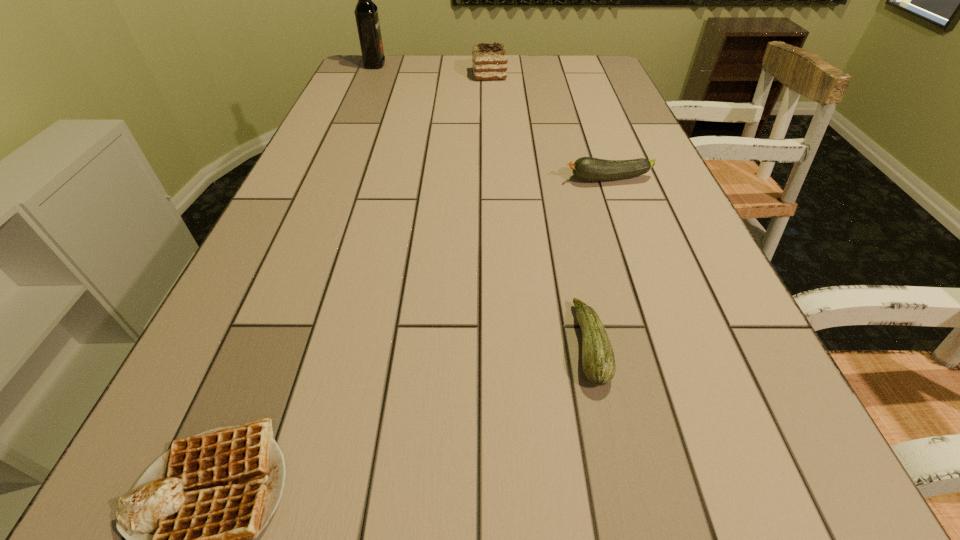
This screenshot has width=960, height=540. Identify the location of free region located 0.070m at the stem end of the nearer zucchini. (532, 344).

What are the coordinates of `vacant space situated at the stem end of the nearer zucchini` in the screenshot? It's located at (355, 344).

You are a GUI agent. You are given a task and a screenshot of the screen. Output one action in this format:
    pyautogui.click(x=<x>, y=<y>)
    Task: Click on the vacant point located at the stem end of the nearer zucchini
    
    Given the screenshot: What is the action you would take?
    pyautogui.click(x=471, y=344)

In order to click on liquor located in the far edge section of the desktop in this screenshot , I will do [366, 12].

Identify the location of chocolate cake located at the far edge. (x=489, y=61).

Locate an element on the screen. object at the left edge is located at coordinates (x=366, y=12).

I want to click on object that is at the right edge, so click(586, 168).

Identify the location of object present at the far left corner. This screenshot has height=540, width=960. (366, 12).

This screenshot has height=540, width=960. Find the location of `vacant space at the far edge`. vacant space at the far edge is located at coordinates 408,76.

You are a GUI agent. You are given a task and a screenshot of the screen. Output one action in this format:
    pyautogui.click(x=<x>, y=<y>)
    Task: Click on the free space at the left edge
    
    Given the screenshot: What is the action you would take?
    pyautogui.click(x=302, y=237)